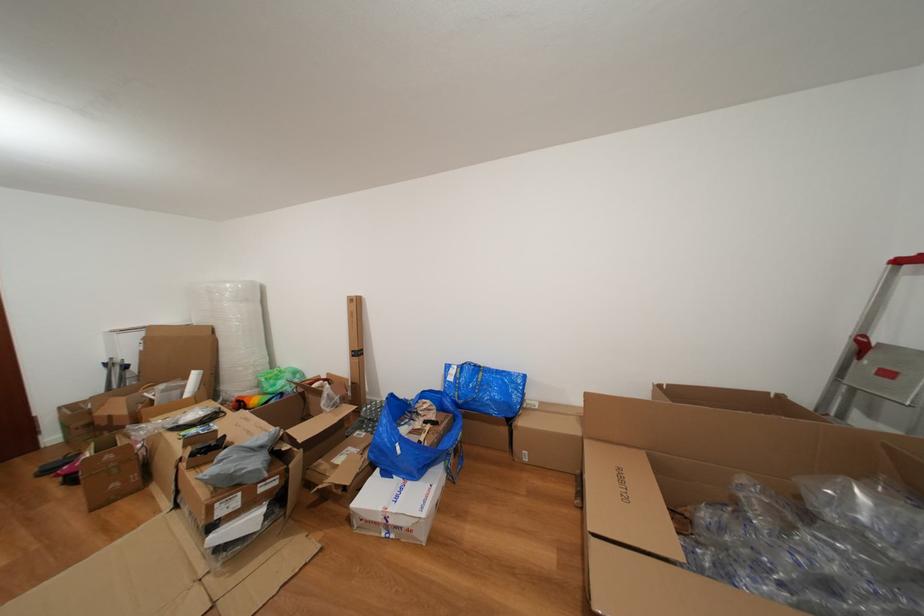
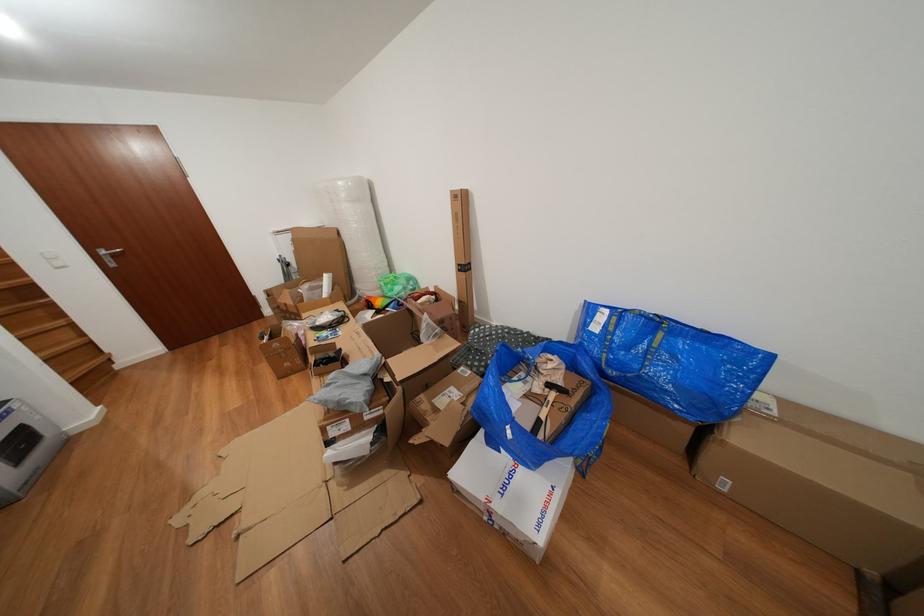
Locate, in the second image, the point that corresponds to point (525, 419) in the first image.

(734, 424)